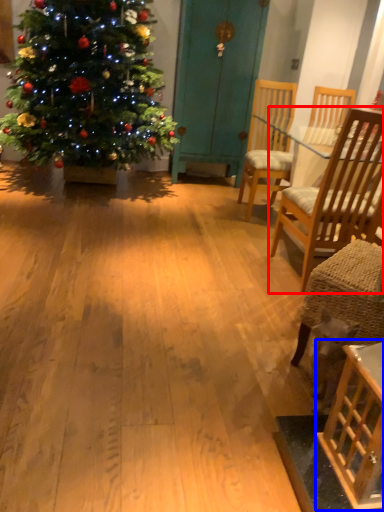
Question: Among these objects, which one is nearest to the camera, chair (highlighted by a red box) or table (highlighted by a blue box)?

Choices:
 (A) chair
 (B) table

Answer: (B)